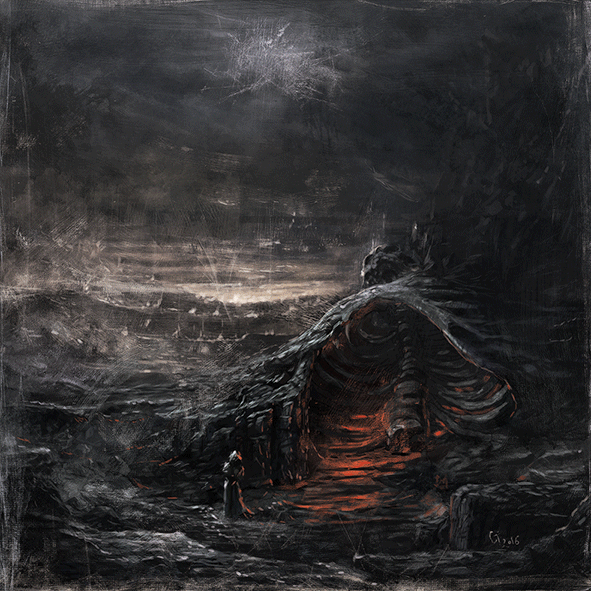
Image resolution: width=591 pixels, height=591 pixels. Find the location of `carpet`. carpet is located at coordinates (540, 357).